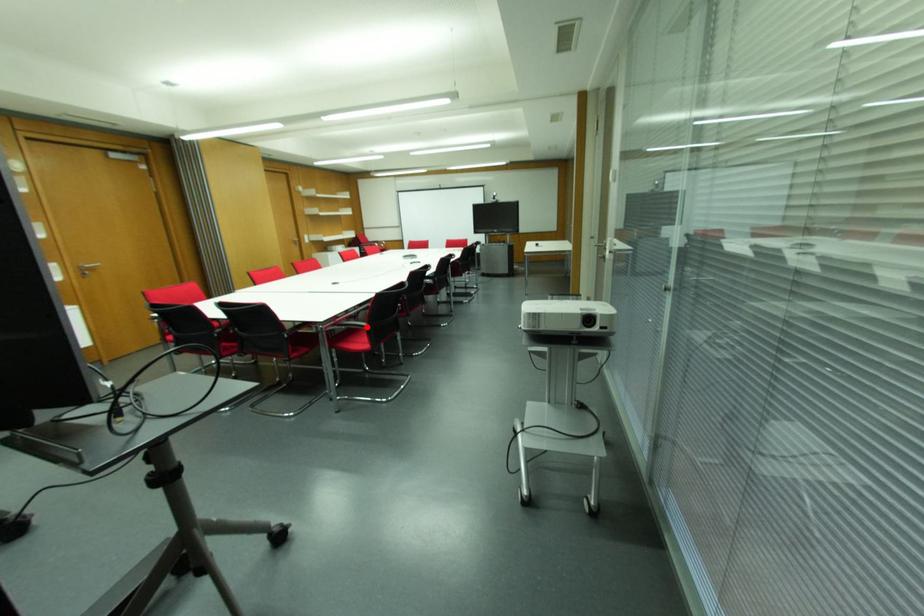
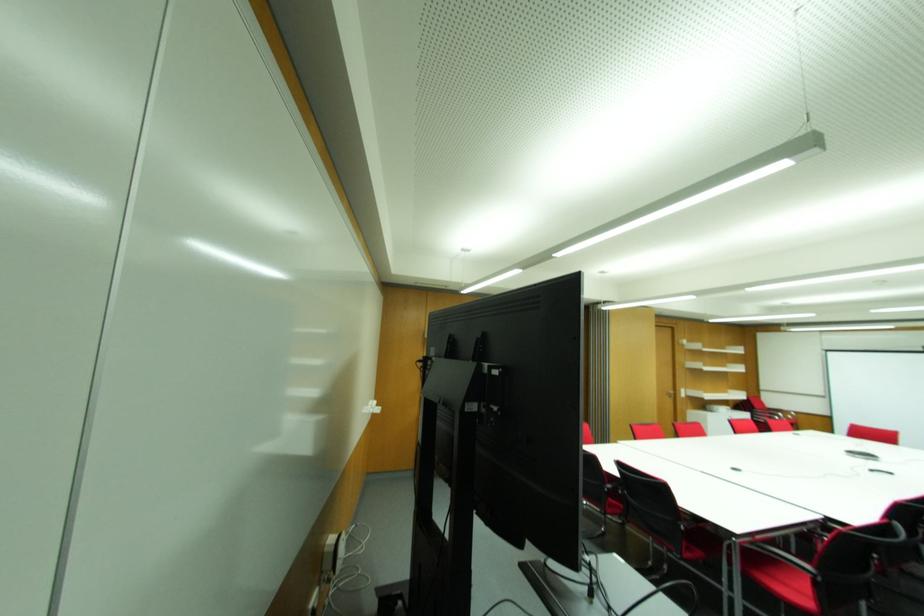
Locate, in the second image, the point that corresponds to the highlighted location in the first image.

(815, 576)